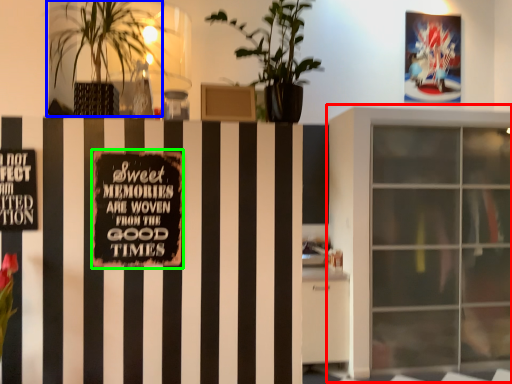
Question: Which object is positioned farthest from window (highlighted by a red box)? Select from houseplant (highlighted by a blue box) and bulletin board (highlighted by a green box).

Choices:
 (A) houseplant
 (B) bulletin board

Answer: (B)